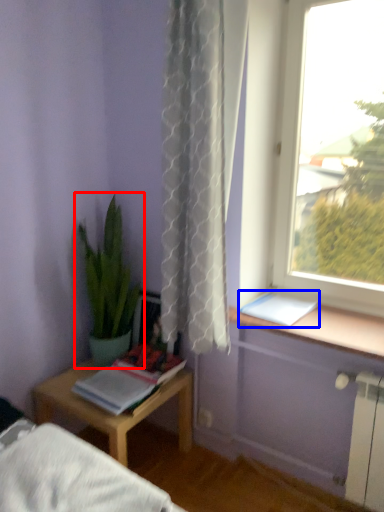
Question: Among these objects, which one is nearest to the camera, houseplant (highlighted by a red box) or book (highlighted by a blue box)?

Choices:
 (A) houseplant
 (B) book

Answer: (B)